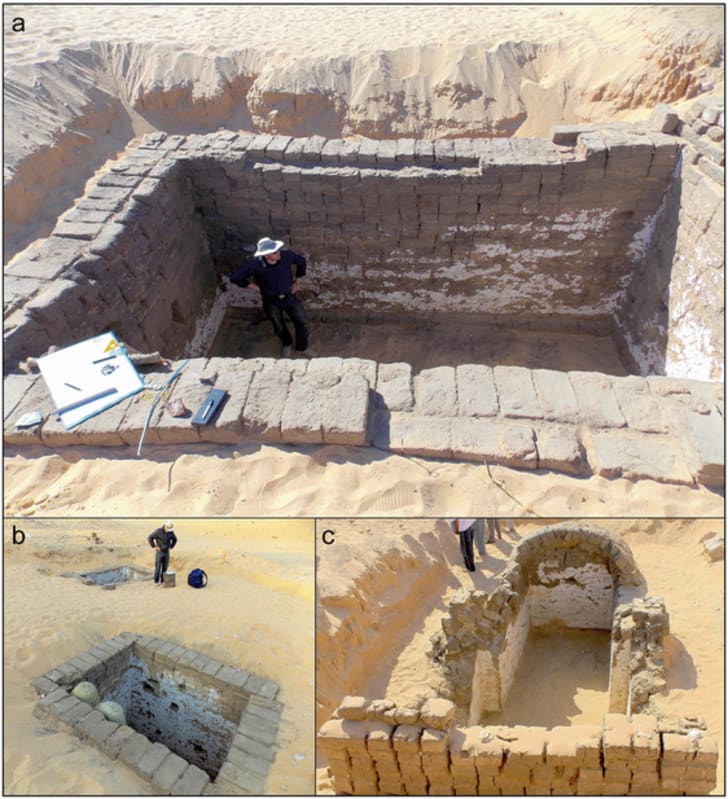
Locate an element on the screen. This screenshot has width=728, height=799. drafting triangle is located at coordinates click(113, 344).